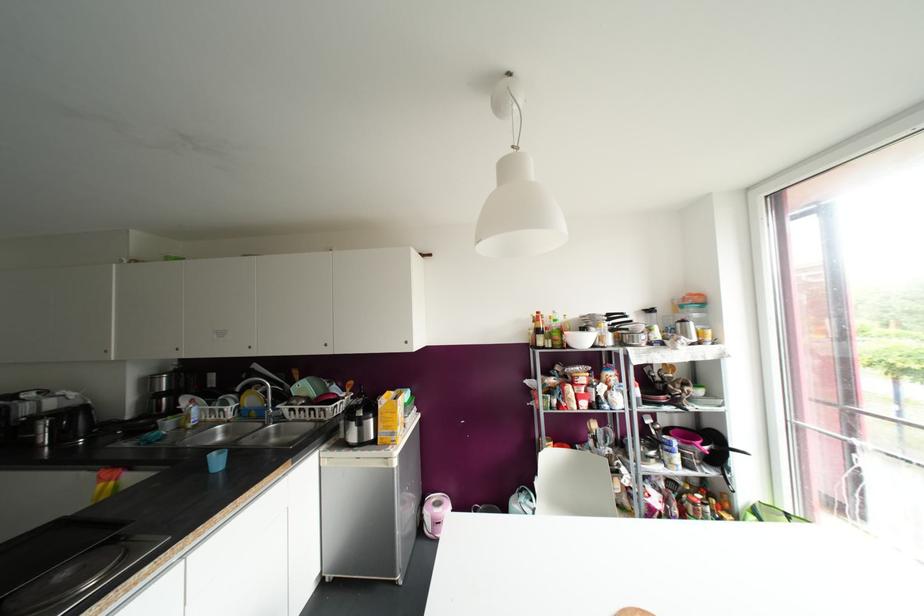
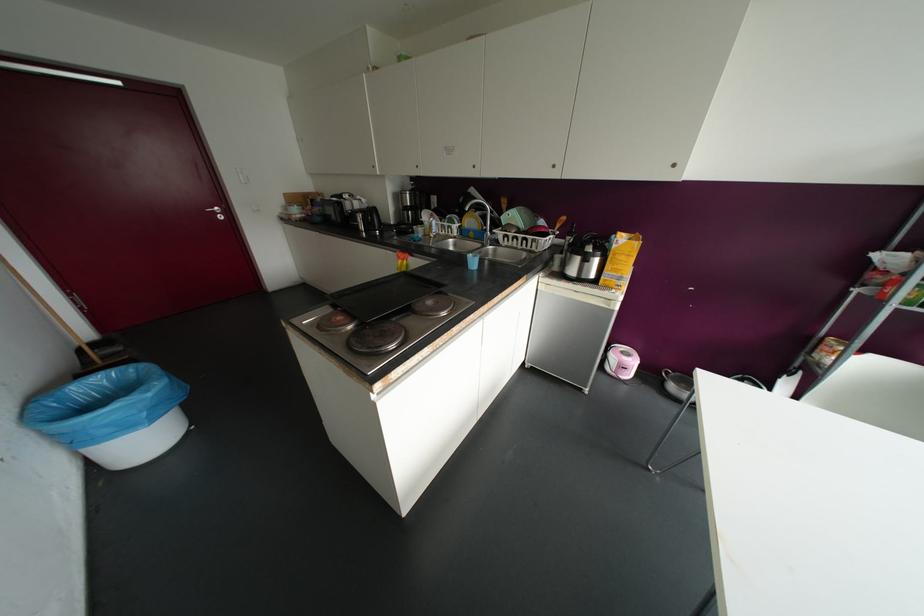
The point at [324,344] is marked in the first image. Where is the corresponding point in the second image?

(553, 166)